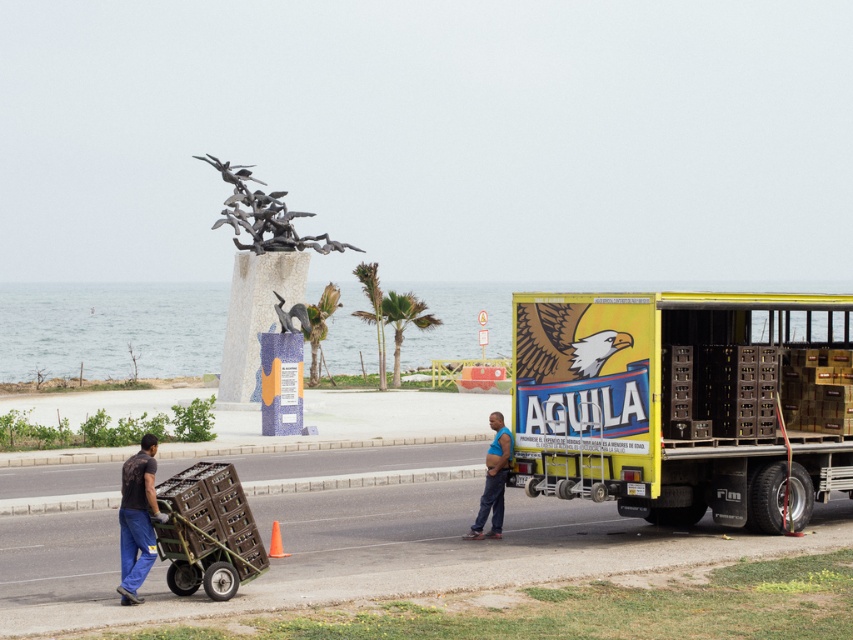
You are a photographer positioned at the edge of the road in the coastal scene. You want to take a photo that includes both the dark blue jeans at lower left and the blue fabric shirt at center. Which object should you adjust your camera to focus on first to ensure both are in the frame?

You should focus on the dark blue jeans at lower left first because it is to the left of the blue fabric shirt at center, so adjusting from left to right will capture both.

You are a pedestrian standing at the center of the coastal road. You see the yellow matte trailer truck at right and the blue fabric shirt at center. Which object is positioned further to the right?

The yellow matte trailer truck at right is positioned further to the right than the blue fabric shirt at center.

You are standing at the center of the road in the coastal scene. You see a point marked at coordinates (685, 403). What object is located at that point?

The point at coordinates (685, 403) indicates the yellow matte trailer truck at right.